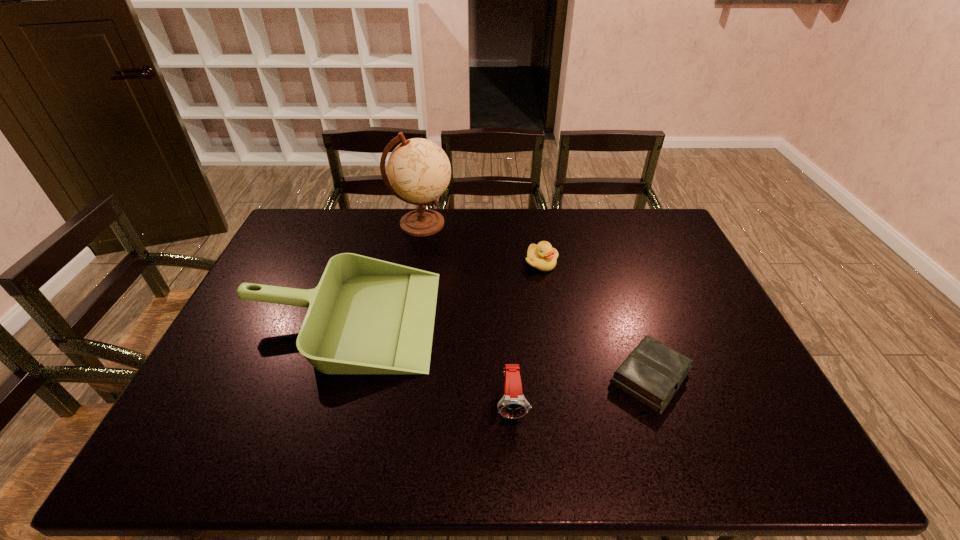
Locate an element on the screen. The height and width of the screenshot is (540, 960). vacant space that satisfies the following two spatial constraints: 1. on the beak of the second object from right to left; 2. on the left side of the shortest object is located at coordinates (561, 377).

Find the location of a particular element. vacant space that satisfies the following two spatial constraints: 1. on the beak of the fourth object from left to right; 2. on the scoop of the dustpan is located at coordinates (550, 319).